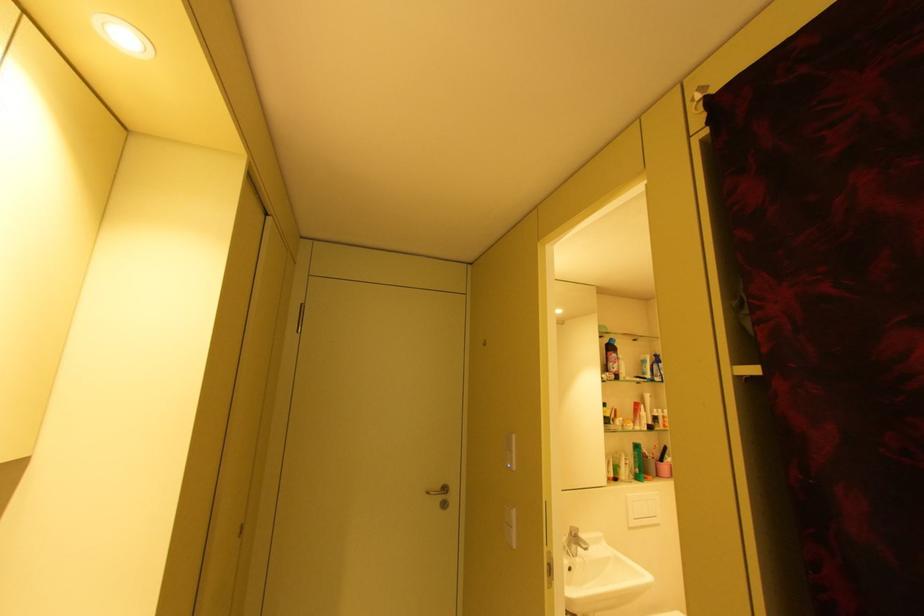
The width and height of the screenshot is (924, 616). What do you see at coordinates (439, 490) in the screenshot? I see `the silver door handle` at bounding box center [439, 490].